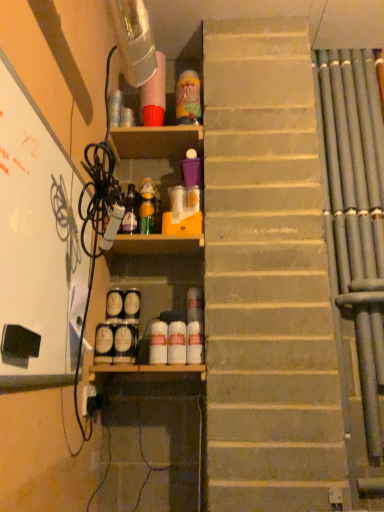
Question: Looking at the image, does translucent plastic bottle at upper center, arranged as the 1th bottle when viewed from the top, seem bigger or smaller compared to white glossy bottle at center, which is the second bottle from right to left?

Choices:
 (A) small
 (B) big

Answer: (B)

Question: Is point (183, 96) positioned closer to the camera than point (178, 361)?

Choices:
 (A) closer
 (B) farther

Answer: (B)

Question: Which is farther from the white matte bottle at center, the 1th bottle from the bottom?

Choices:
 (A) translucent plastic bottle at center, arranged as the third bottle when ordered from the bottom
 (B) white plastic electric outlet at lower left
 (C) white glossy bottle at center, which is the fourth bottle from top to bottom
 (D) translucent plastic bottle at upper center, the fifth bottle when ordered from bottom to top
 (E) white matte bulletin board at left

Answer: (D)

Question: Which is nearer to the translucent plastic bottle at center, arranged as the third bottle when ordered from the bottom?

Choices:
 (A) white matte bulletin board at left
 (B) white matte bottle at center, the 5th bottle positioned from the top
 (C) translucent plastic bottle at upper center, the 1th bottle when ordered from right to left
 (D) white plastic electric outlet at lower left
 (E) white glossy bottle at center, marked as the 4th bottle in a left-to-right arrangement

Answer: (C)